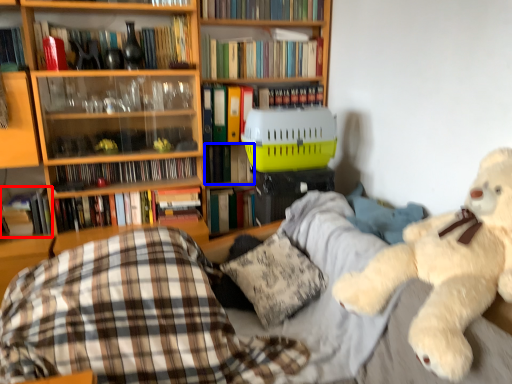
Question: Which object is closer to the camera taking this photo, book (highlighted by a red box) or book (highlighted by a blue box)?

Choices:
 (A) book
 (B) book

Answer: (A)